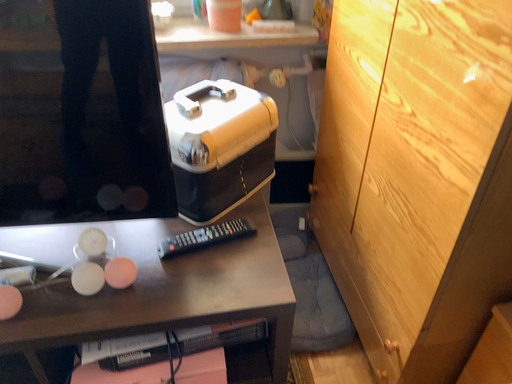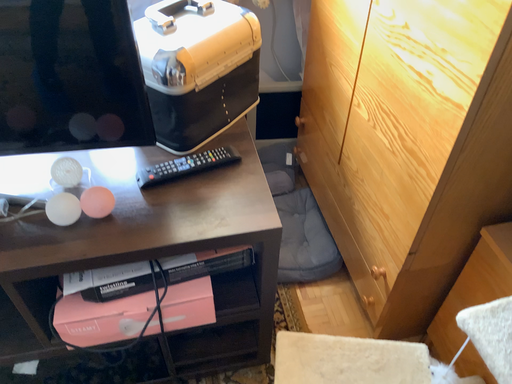
Question: Which way did the camera rotate in the video?

Choices:
 (A) rotated upward
 (B) rotated downward

Answer: (B)